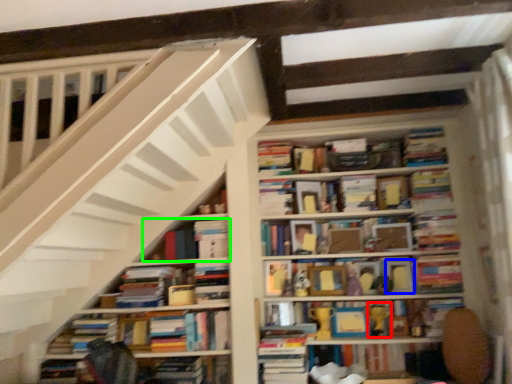
Question: Which object is the farthest from toy (highlighted by a red box)? Choose among these: paperback book (highlighted by a blue box) or book (highlighted by a green box).

Choices:
 (A) paperback book
 (B) book

Answer: (B)